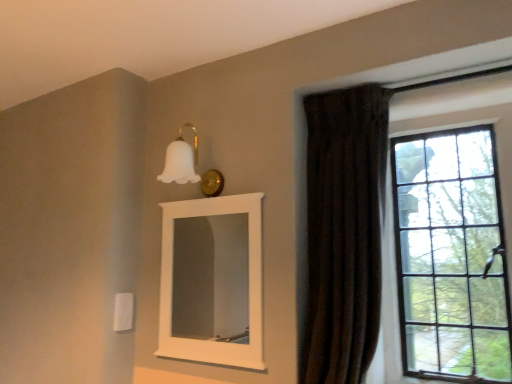
Question: Is brown velvet curtain at right spatially inside white matte mirror at upper center, or outside of it?

Choices:
 (A) inside
 (B) outside

Answer: (B)

Question: From a real-world perspective, is brown velvet curtain at right positioned above or below white matte mirror at upper center?

Choices:
 (A) above
 (B) below

Answer: (A)

Question: Estimate the real-world distances between objects in this image. Which object is farther from the white matte mirror at upper center?

Choices:
 (A) brown velvet curtain at right
 (B) white matte glass sconce at upper center
 (C) clear glass window at right

Answer: (C)

Question: Which object is the farthest from the brown velvet curtain at right?

Choices:
 (A) clear glass window at right
 (B) white matte mirror at upper center
 (C) white matte glass sconce at upper center

Answer: (B)